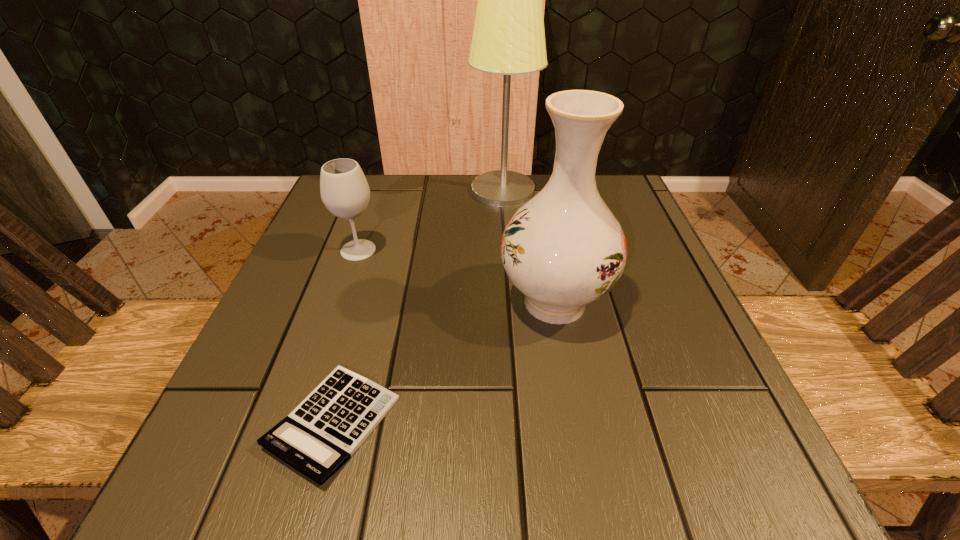
Locate an element on the screen. The width and height of the screenshot is (960, 540). table lamp is located at coordinates (508, 38).

What are the coordinates of `the tallest object` in the screenshot? It's located at (508, 38).

The width and height of the screenshot is (960, 540). I want to click on vase, so click(563, 249).

The height and width of the screenshot is (540, 960). I want to click on the second nearest object, so click(563, 249).

The width and height of the screenshot is (960, 540). Identify the location of wineglass. (345, 192).

This screenshot has height=540, width=960. I want to click on the third nearest object, so click(x=345, y=192).

Where is `the shortest object`? The height and width of the screenshot is (540, 960). the shortest object is located at coordinates (320, 435).

I want to click on calculator, so click(x=320, y=435).

Locate an element on the screen. This screenshot has height=540, width=960. free space located on the left of the farthest object is located at coordinates (331, 190).

This screenshot has width=960, height=540. I want to click on vacant space situated on the back of the vase, so click(x=543, y=239).